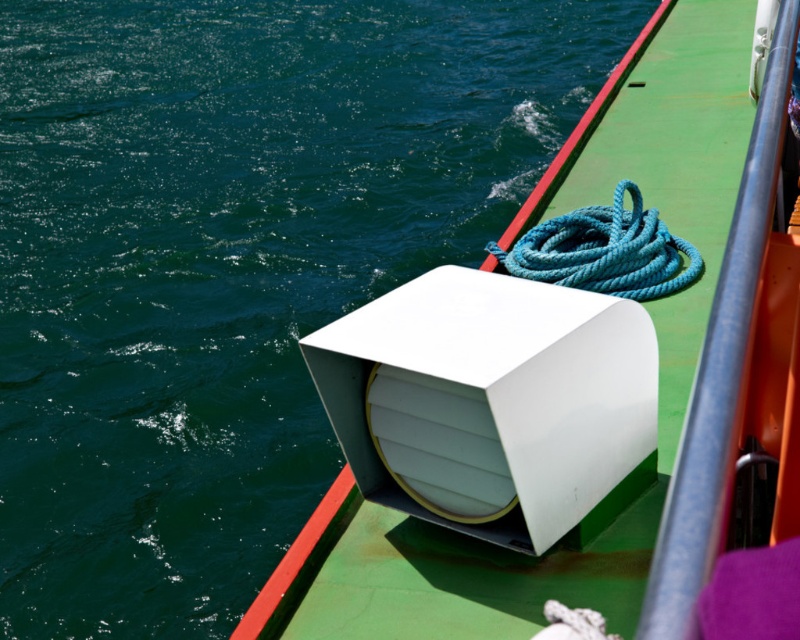
Question: Which point is farther to the camera?

Choices:
 (A) (384, 608)
 (B) (592, 268)

Answer: (B)

Question: Is white matte speaker at center positioned at the back of teal rope at upper right?

Choices:
 (A) no
 (B) yes

Answer: (A)

Question: From the image, what is the correct spatial relationship of white matte speaker at center in relation to teal rope at upper right?

Choices:
 (A) above
 (B) below

Answer: (A)

Question: Is white matte speaker at center positioned in front of teal rope at upper right?

Choices:
 (A) yes
 (B) no

Answer: (A)

Question: Which of the following is the farthest from the observer?

Choices:
 (A) white matte speaker at center
 (B) teal rope at upper right

Answer: (B)